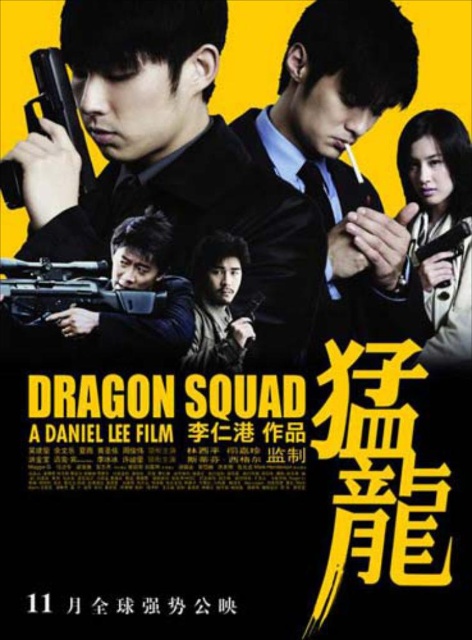
You are a movie poster designer reviewing the layout of the Dragon Squad poster. You need to place a new element between the matte black gun at upper right and the polished silver pistol at upper left. Which gun should be closer to the center of the poster?

The polished silver pistol at upper left is closer to the center of the poster since the matte black gun at upper right is positioned on the right side of it.

You are a prop manager checking the movie poster for Dragon Squad. You need to ensure that all weapons are correctly sized according to the script. The script specifies that the matte black gun at upper right should be larger than the polished silver pistol at upper left. Does the poster comply with this requirement?

The matte black gun at upper right is bigger than the polished silver pistol at upper left, so the poster complies with the script requirement.

You are a movie prop designer reviewing the Dragon Squad poster. You need to ensure that all weapons are correctly positioned according to the script. According to the poster, which weapon is positioned to the right of the other between the matte black gun at center and the matte black sniper rifle at center?

The matte black gun at center is positioned to the right of the matte black sniper rifle at center.